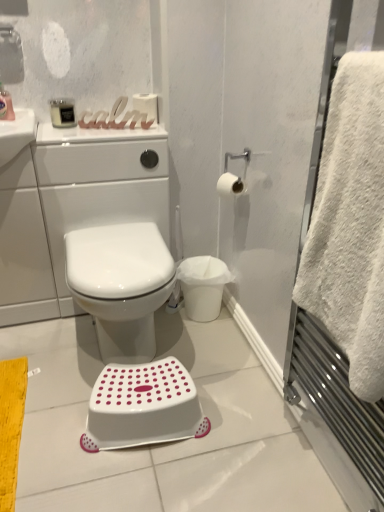
Identify the location of vacant area to the left of white glossy bidet at center. This screenshot has width=384, height=512. (45, 359).